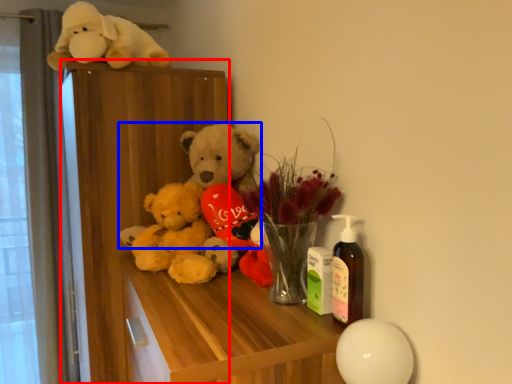
Question: Which object appears farthest to the camera in this image, dresser (highlighted by a red box) or teddy bear (highlighted by a blue box)?

Choices:
 (A) dresser
 (B) teddy bear

Answer: (A)